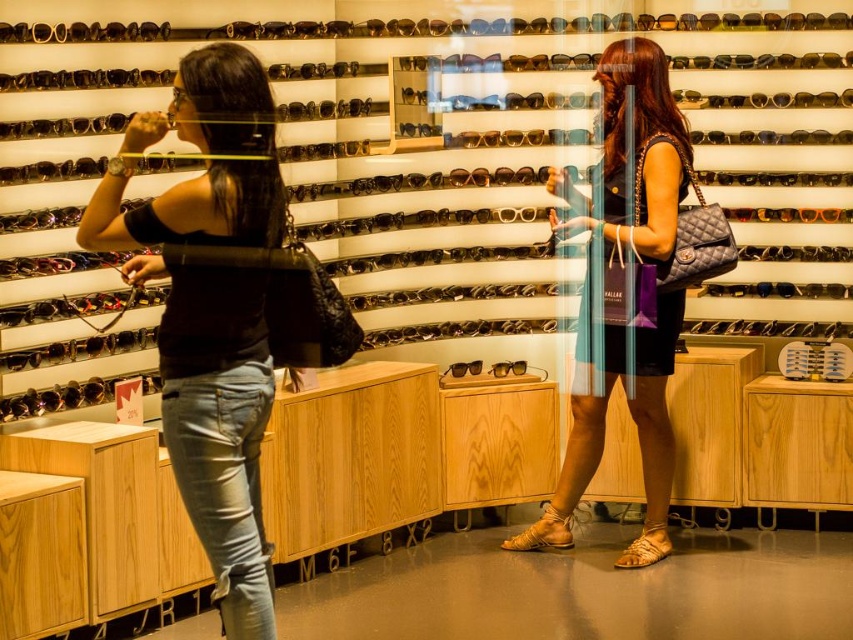
Question: Which point appears farthest from the camera in this image?

Choices:
 (A) (202, 97)
 (B) (653, 320)

Answer: (B)

Question: Does matte black top at left have a lesser width compared to matte black dress at center?

Choices:
 (A) no
 (B) yes

Answer: (B)

Question: Which object appears closest to the camera in this image?

Choices:
 (A) matte black dress at center
 (B) matte black top at left

Answer: (B)

Question: Is matte black top at left above matte black dress at center?

Choices:
 (A) yes
 (B) no

Answer: (B)

Question: Does matte black top at left appear over matte black dress at center?

Choices:
 (A) no
 (B) yes

Answer: (A)

Question: Which of the following is the farthest from the observer?

Choices:
 (A) matte black dress at center
 (B) matte black top at left

Answer: (A)